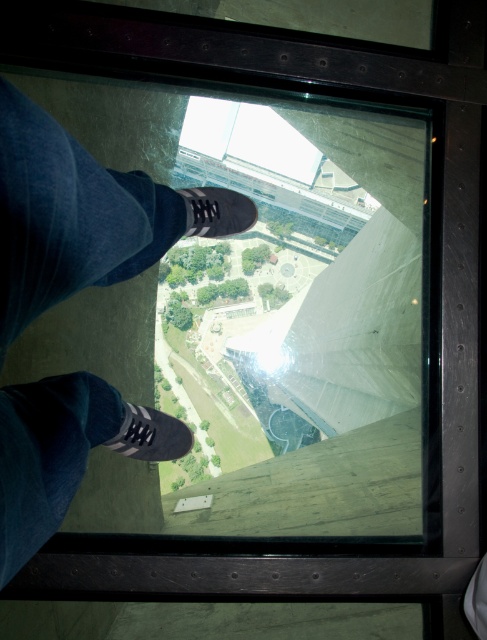
You are standing on the glass floor and want to hide your black suede shoe at center behind your dark blue jeans at center. Is this possible given their sizes?

The dark blue jeans at center is larger in size than the black suede shoe at center, so yes, you can hide the black suede shoe at center behind the dark blue jeans at center using their size difference.

You are standing on a glass floor and looking down. You see your dark blue jeans at center and a black suede shoe at lower left. Which object takes up more space in your field of view?

The dark blue jeans at center takes up more space in your field of view because it is larger in size than the black suede shoe at lower left.

You are standing on the glass floor and want to place a small object on the floor near the black suede shoe at lower left. Considering the position of the dark blue jeans at center, will the object be visible through the glass from above?

The dark blue jeans at center is closer to the viewer than the black suede shoe at lower left, so placing the object near the black suede shoe at lower left would still allow it to be seen from above since it is behind the jeans but still on the glass floor.